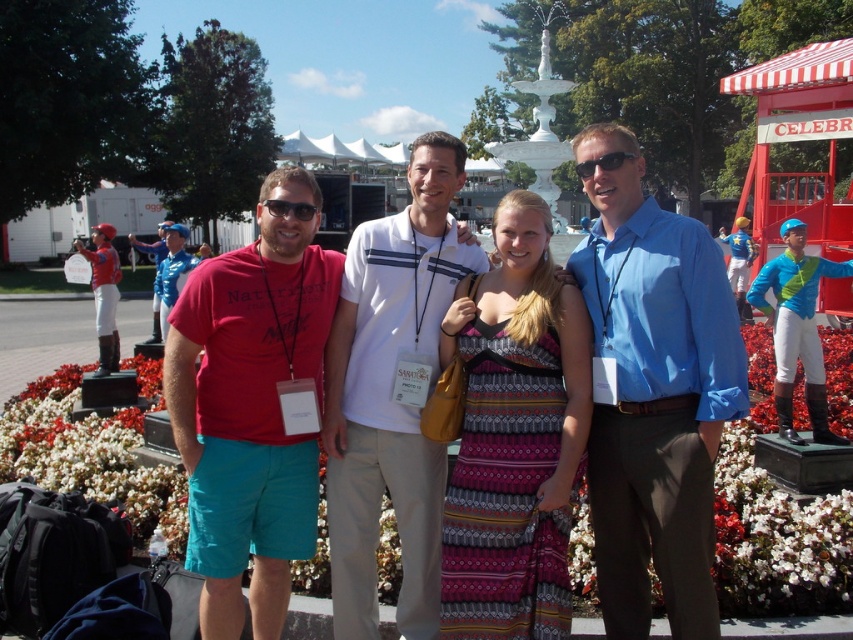
Question: Can you confirm if patterned fabric dress at center is positioned below white cotton polo shirt at center?

Choices:
 (A) yes
 (B) no

Answer: (B)

Question: Among these points, which one is nearest to the camera?

Choices:
 (A) 369,284
 (B) 709,269
 (C) 230,444
 (D) 613,561

Answer: (B)

Question: Which is nearer to the white cotton polo shirt at center?

Choices:
 (A) patterned fabric dress at center
 (B) matte red t-shirt at left

Answer: (A)

Question: Estimate the real-world distances between objects in this image. Which object is closer to the patterned fabric dress at center?

Choices:
 (A) white cotton polo shirt at center
 (B) blue cotton shirt at center
 (C) matte red t-shirt at center

Answer: (B)

Question: Does matte red t-shirt at left appear on the right side of white cotton polo shirt at center?

Choices:
 (A) no
 (B) yes

Answer: (B)

Question: Can you confirm if matte red t-shirt at center is positioned above patterned fabric dress at center?

Choices:
 (A) no
 (B) yes

Answer: (B)